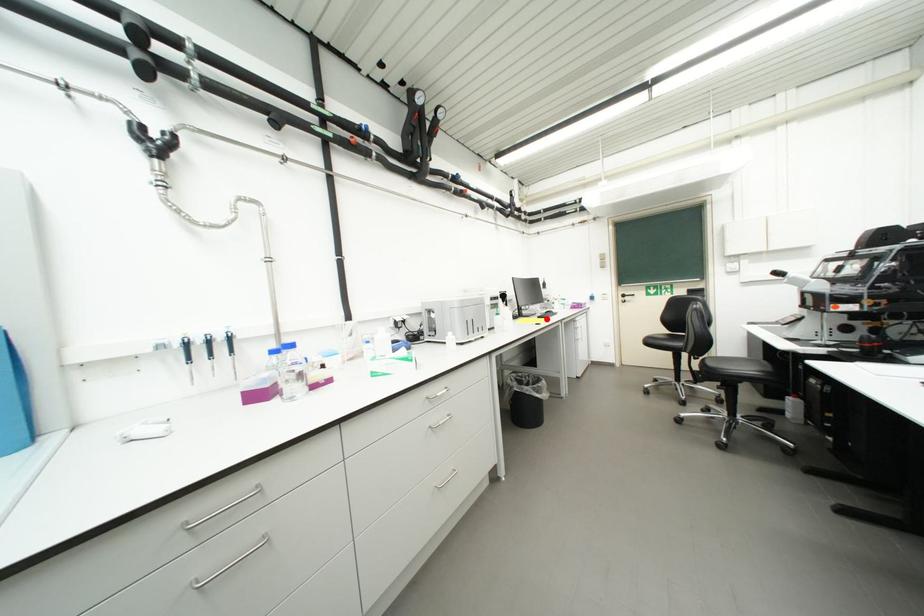
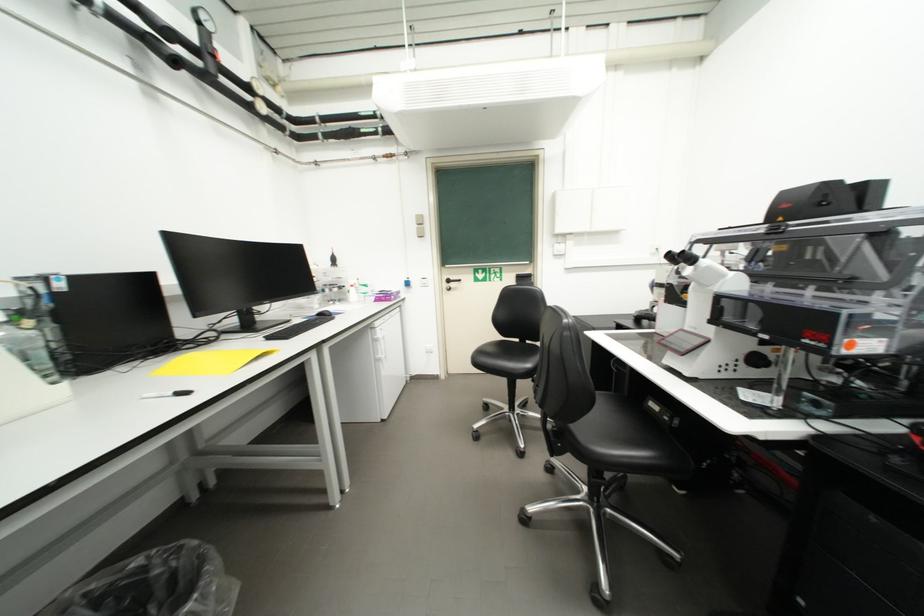
Find the pixel in the second image that matches the highlighted location in the first image.

(276, 339)